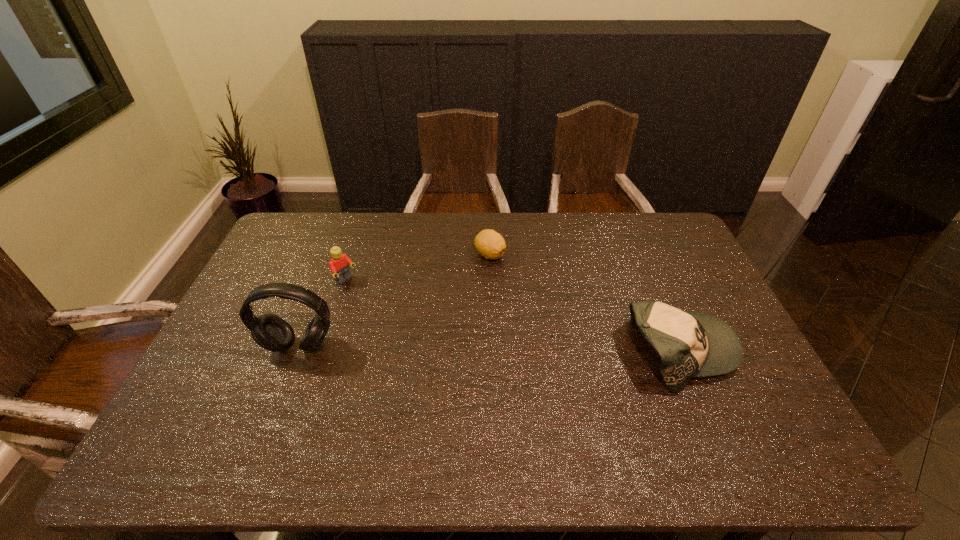
The image size is (960, 540). Identify the location of vacant space on the desktop that is between the tallest object and the rightmost object and is positioned at the stem end of the lemon. (539, 349).

Locate an element on the screen. vacant space on the desktop that is between the headset and the rightmost object and is positioned on the face of the Lego is located at coordinates (440, 348).